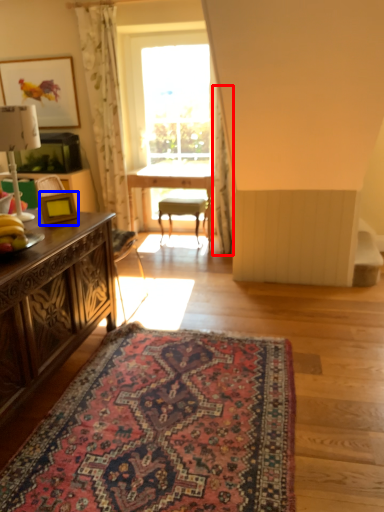
Question: Which of the following is the closest to the observer, curtain (highlighted by a red box) or picture frame (highlighted by a blue box)?

Choices:
 (A) curtain
 (B) picture frame

Answer: (B)